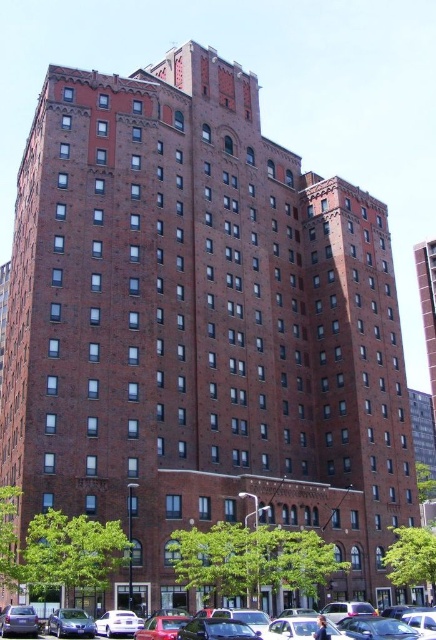
Question: Is metallic blue sedan at lower left below matte blue sedan at lower left?

Choices:
 (A) no
 (B) yes

Answer: (B)

Question: Observing the image, what is the correct spatial positioning of matte red car at center in reference to metallic blue sedan at lower left?

Choices:
 (A) above
 (B) below

Answer: (B)

Question: Which object is farther from the camera taking this photo?

Choices:
 (A) metallic blue sedan at lower left
 (B) matte blue sedan at lower left
 (C) matte red car at center

Answer: (A)

Question: Which is nearer to the matte red car at center?

Choices:
 (A) matte blue sedan at lower left
 (B) metallic blue sedan at lower left

Answer: (A)

Question: From the image, what is the correct spatial relationship of matte red car at center in relation to metallic blue sedan at lower left?

Choices:
 (A) above
 (B) below

Answer: (B)

Question: Considering the real-world distances, which object is farthest from the metallic blue sedan at lower left?

Choices:
 (A) matte red car at center
 (B) matte blue sedan at lower left

Answer: (A)